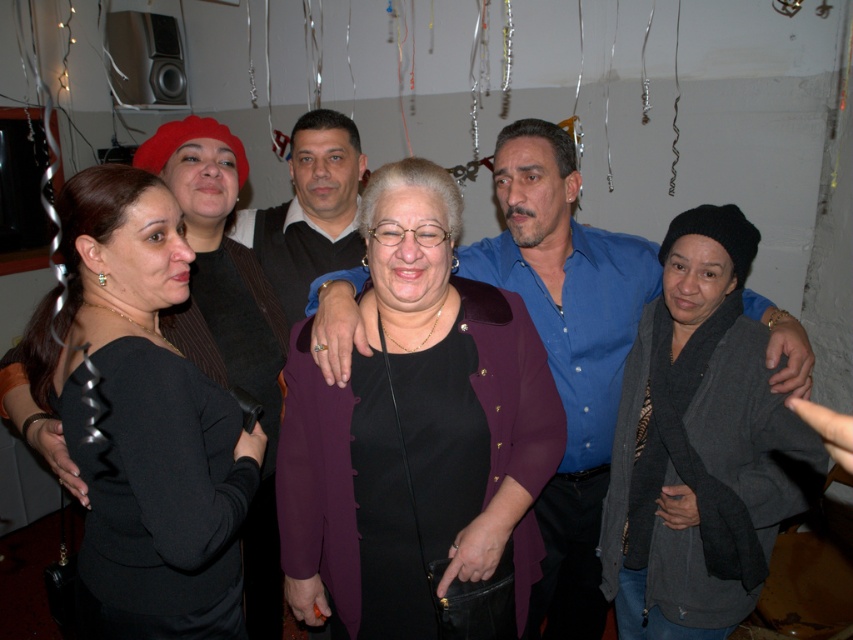
Question: Among these objects, which one is farthest from the camera?

Choices:
 (A) purple matte jacket at center
 (B) black matte dress at left
 (C) dark gray woolen scarf at center

Answer: (C)

Question: Which object is the farthest from the blue smooth shirt at center?

Choices:
 (A) purple matte jacket at center
 (B) dark gray woolen scarf at center

Answer: (A)

Question: In this image, where is purple matte jacket at center located relative to black matte dress at left?

Choices:
 (A) right
 (B) left

Answer: (A)

Question: Which object appears farthest from the camera in this image?

Choices:
 (A) blue smooth shirt at center
 (B) matte black vest at center
 (C) purple matte jacket at center
 (D) black matte dress at left

Answer: (B)

Question: Observing the image, what is the correct spatial positioning of purple matte jacket at center in reference to matte black vest at center?

Choices:
 (A) right
 (B) left

Answer: (A)

Question: In this image, where is black matte dress at left located relative to blue smooth shirt at center?

Choices:
 (A) left
 (B) right

Answer: (A)